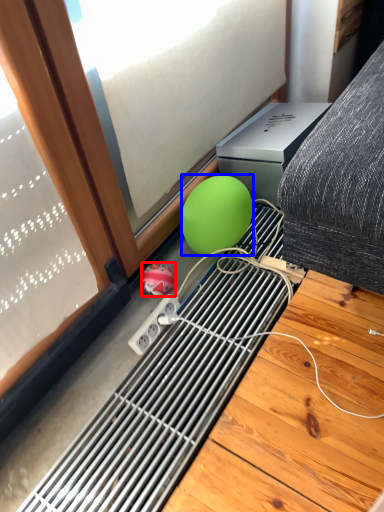
Question: Which object appears closest to the camera in this image, ball (highlighted by a red box) or ball (highlighted by a blue box)?

Choices:
 (A) ball
 (B) ball

Answer: (B)